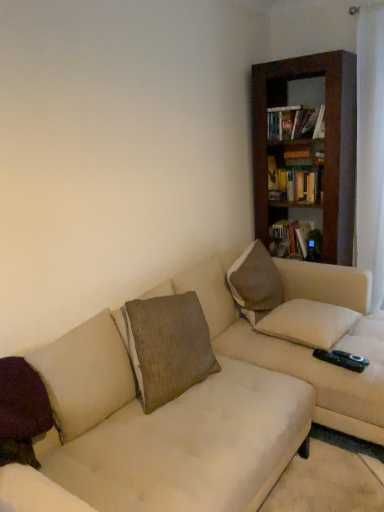
Measure the distance between purple velvet pillow at lower left, placed as the 1th pillow when sorted from front to back, and camera.

They are 1.23 meters apart.

Locate an element on the screen. beige fabric couch at center is located at coordinates (203, 400).

This screenshot has height=512, width=384. Describe the element at coordinates (370, 149) in the screenshot. I see `white fabric curtain at right` at that location.

The width and height of the screenshot is (384, 512). Identify the location of white textured pillow at center, arranged as the third pillow when viewed from the left. (308, 323).

Image resolution: width=384 pixels, height=512 pixels. Describe the element at coordinates (255, 283) in the screenshot. I see `brown textured pillow at upper right, the 3th pillow when ordered from front to back` at that location.

Identify the location of hardcover book at upper right, which ranks as the 1th book in bottom-to-top order. (289, 237).

Are brown textured pillow at upper right, the 1th pillow when ordered from back to front, and brown wooden bookcase at upper right making contact?

No, brown textured pillow at upper right, the 1th pillow when ordered from back to front, is not touching brown wooden bookcase at upper right.

Considering the relative sizes of brown textured pillow at upper right, the 1th pillow when ordered from back to front, and brown wooden bookcase at upper right in the image provided, is brown textured pillow at upper right, the 1th pillow when ordered from back to front, taller than brown wooden bookcase at upper right?

No, brown textured pillow at upper right, the 1th pillow when ordered from back to front, is not taller than brown wooden bookcase at upper right.

Is brown textured pillow at upper right, the 3th pillow when ordered from front to back, behind brown wooden bookcase at upper right?

No, brown textured pillow at upper right, the 3th pillow when ordered from front to back, is closer to the camera.

You are a GUI agent. You are given a task and a screenshot of the screen. Output one action in this format:
    pyautogui.click(x=<x>, y=<y>)
    Task: Click on the pillow that is the 2nd object to the left of the brown wooden bookcase at upper right, starting at the anchor
    The image size is (384, 512).
    Given the screenshot: What is the action you would take?
    pyautogui.click(x=255, y=283)

Considering the relative sizes of brown wooden bookcase at upper right and purple velvet pillow at lower left, which appears as the 3th pillow when viewed from the back, in the image provided, is brown wooden bookcase at upper right wider than purple velvet pillow at lower left, which appears as the 3th pillow when viewed from the back,?

Correct, the width of brown wooden bookcase at upper right exceeds that of purple velvet pillow at lower left, which appears as the 3th pillow when viewed from the back.

From a real-world perspective, is brown wooden bookcase at upper right positioned over purple velvet pillow at lower left, placed as the 1th pillow when sorted from front to back, based on gravity?

Yes, from a real-world perspective, brown wooden bookcase at upper right is above purple velvet pillow at lower left, placed as the 1th pillow when sorted from front to back.

Which point is more distant from viewer, (302, 67) or (20, 357)?

Positioned behind is point (302, 67).

This screenshot has width=384, height=512. I want to click on studio couch on the left of the brown wooden bookcase at upper right, so click(x=203, y=400).

Is the position of brown wooden bookcase at upper right more distant than that of beige fabric couch at center?

Yes, it is behind beige fabric couch at center.

From the image's perspective, which object appears higher, brown wooden bookcase at upper right or beige fabric couch at center?

brown wooden bookcase at upper right is shown above in the image.

Is brown wooden bookcase at upper right next to beige fabric couch at center and touching it?

No, brown wooden bookcase at upper right is not beside beige fabric couch at center.

Could brown textured pillow at upper right, the 3th pillow when ordered from front to back, be considered to be inside beige fabric couch at center?

Definitely not — brown textured pillow at upper right, the 3th pillow when ordered from front to back, is not inside beige fabric couch at center.

Could you tell me if beige fabric couch at center is turned towards brown textured pillow at upper right, the 1th pillow when ordered from back to front?

No, beige fabric couch at center does not turn towards brown textured pillow at upper right, the 1th pillow when ordered from back to front.

Does beige fabric couch at center appear on the left side of brown textured pillow at upper right, the 1th pillow when ordered from back to front?

Indeed, beige fabric couch at center is positioned on the left side of brown textured pillow at upper right, the 1th pillow when ordered from back to front.

Considering the relative sizes of beige fabric couch at center and brown textured pillow at upper right, placed as the 2th pillow when sorted from left to right, in the image provided, is beige fabric couch at center shorter than brown textured pillow at upper right, placed as the 2th pillow when sorted from left to right,?

In fact, beige fabric couch at center may be taller than brown textured pillow at upper right, placed as the 2th pillow when sorted from left to right.

Considering the sizes of white fabric curtain at right and hardcover book at upper right, acting as the 1th book starting from the top, in the image, is white fabric curtain at right taller or shorter than hardcover book at upper right, acting as the 1th book starting from the top,?

Clearly, white fabric curtain at right is taller compared to hardcover book at upper right, acting as the 1th book starting from the top.

Looking at this image, is white fabric curtain at right next to hardcover book at upper right, acting as the 1th book starting from the top, and touching it?

No, white fabric curtain at right is not in contact with hardcover book at upper right, acting as the 1th book starting from the top.

Considering the relative sizes of white fabric curtain at right and hardcover book at upper right, the 1th book in the front-to-back sequence, in the image provided, is white fabric curtain at right smaller than hardcover book at upper right, the 1th book in the front-to-back sequence,?

No.

Which object is more forward, hardcover book at upper right, which appears as the second book when viewed from the back, or white textured pillow at center, placed as the first pillow when sorted from right to left?

white textured pillow at center, placed as the first pillow when sorted from right to left, is closer to the camera.

Which is in front, point (297, 126) or point (306, 328)?

The point (306, 328) is closer to the camera.

Who is smaller, hardcover book at upper right, the 1th book in the front-to-back sequence, or white textured pillow at center, the 2th pillow from the front?

hardcover book at upper right, the 1th book in the front-to-back sequence.

Which is more to the right, brown textured pillow at upper right, the 1th pillow when ordered from back to front, or hardcover book at upper right, the second book in the top-to-bottom sequence?

hardcover book at upper right, the second book in the top-to-bottom sequence, is more to the right.

Between brown textured pillow at upper right, placed as the 2th pillow when sorted from left to right, and hardcover book at upper right, which ranks as the 1th book in bottom-to-top order, which one has smaller width?

hardcover book at upper right, which ranks as the 1th book in bottom-to-top order, is thinner.

Is brown textured pillow at upper right, which appears as the second pillow when viewed from the right, next to hardcover book at upper right, which appears as the second book when viewed from the front?

No, brown textured pillow at upper right, which appears as the second pillow when viewed from the right, is not next to hardcover book at upper right, which appears as the second book when viewed from the front.

Is brown textured pillow at upper right, the 3th pillow when ordered from front to back, situated inside hardcover book at upper right, the second book in the top-to-bottom sequence, or outside?

brown textured pillow at upper right, the 3th pillow when ordered from front to back, is located beyond the bounds of hardcover book at upper right, the second book in the top-to-bottom sequence.

From the image's perspective, count 1st pillows downward from the brown wooden bookcase at upper right and point to it. Please provide its 2D coordinates.

[(255, 283)]

At what (x,y) coordinates should I click in order to perform the action: click on bookcase above the purple velvet pillow at lower left, which appears as the 3th pillow when viewed from the back (from a real-world perspective). Please return your answer as a coordinate pair (x, y). The height and width of the screenshot is (512, 384). Looking at the image, I should click on (325, 142).

Considering their positions, is purple velvet pillow at lower left, placed as the third pillow when sorted from right to left, positioned closer to white fabric curtain at right than hardcover book at upper right, which ranks as the 1th book in bottom-to-top order?

The object closer to white fabric curtain at right is hardcover book at upper right, which ranks as the 1th book in bottom-to-top order.

Estimate the real-world distances between objects in this image. Which object is further from hardcover book at upper right, which appears as the second book when viewed from the front, brown wooden bookcase at upper right or beige fabric couch at center?

The object further to hardcover book at upper right, which appears as the second book when viewed from the front, is beige fabric couch at center.

Estimate the real-world distances between objects in this image. Which object is further from hardcover book at upper right, the second book in the top-to-bottom sequence, white textured pillow at center, the second pillow positioned from the back, or beige fabric couch at center?

Among the two, beige fabric couch at center is located further to hardcover book at upper right, the second book in the top-to-bottom sequence.

Estimate the real-world distances between objects in this image. Which object is closer to brown wooden bookcase at upper right, beige fabric couch at center or white fabric curtain at right?

white fabric curtain at right is positioned closer to the anchor brown wooden bookcase at upper right.

From the image, which object appears to be farther from brown wooden bookcase at upper right, brown textured pillow at upper right, the 1th pillow when ordered from back to front, or purple velvet pillow at lower left, placed as the third pillow when sorted from right to left?

purple velvet pillow at lower left, placed as the third pillow when sorted from right to left, is further to brown wooden bookcase at upper right.

Estimate the real-world distances between objects in this image. Which object is further from purple velvet pillow at lower left, placed as the 1th pillow when sorted from front to back, brown textured pillow at upper right, which appears as the second pillow when viewed from the right, or beige fabric couch at center?

brown textured pillow at upper right, which appears as the second pillow when viewed from the right, lies further to purple velvet pillow at lower left, placed as the 1th pillow when sorted from front to back, than the other object.

From the image, which object appears to be nearer to hardcover book at upper right, which appears as the second book when viewed from the front, brown textured pillow at upper right, the 1th pillow when ordered from back to front, or beige fabric couch at center?

The object closer to hardcover book at upper right, which appears as the second book when viewed from the front, is brown textured pillow at upper right, the 1th pillow when ordered from back to front.

From the picture: Based on their spatial positions, is beige fabric couch at center or white fabric curtain at right closer to hardcover book at upper right, which appears as the second book when viewed from the back?

Answer: white fabric curtain at right.

Find the location of a particular element. bookcase located between beige fabric couch at center and hardcover book at upper right, the second book in the top-to-bottom sequence, in the depth direction is located at coordinates (325, 142).

The width and height of the screenshot is (384, 512). In order to click on book located between beige fabric couch at center and hardcover book at upper right, marked as the 1th book in a back-to-front arrangement, in the depth direction in this screenshot , I will do (294, 123).

Locate an element on the screen. The height and width of the screenshot is (512, 384). curtain between brown wooden bookcase at upper right and brown textured pillow at upper right, the 3th pillow when ordered from front to back, from top to bottom is located at coordinates (370, 149).

Locate an element on the screen. The image size is (384, 512). bookcase between brown textured pillow at upper right, the 3th pillow when ordered from front to back, and hardcover book at upper right, which ranks as the 1th book in bottom-to-top order, along the z-axis is located at coordinates (x=325, y=142).